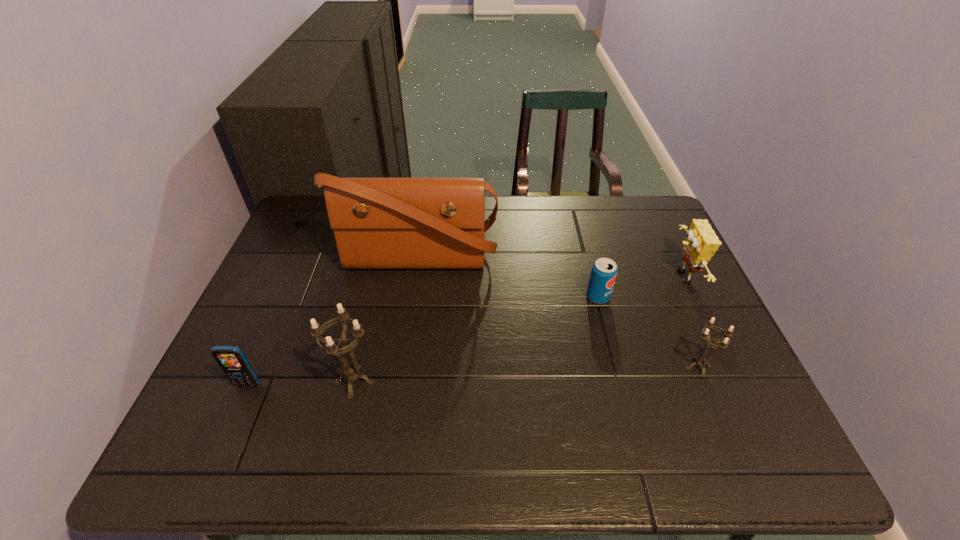
Identify the location of vacant area in the image that satisfies the following two spatial constraints: 1. on the front flap of the shorter candle holder; 2. on the left side of the tallest object. The image size is (960, 540). (402, 367).

The image size is (960, 540). Identify the location of free location that satisfies the following two spatial constraints: 1. on the face of the third tallest object; 2. on the front side of the taller candle holder. (731, 381).

You are a GUI agent. You are given a task and a screenshot of the screen. Output one action in this format:
    pyautogui.click(x=<x>, y=<y>)
    Task: Click on the vacant area in the image that satisfies the following two spatial constraints: 1. on the face of the sponge; 2. on the screen of the leftmost object
    The image size is (960, 540).
    Given the screenshot: What is the action you would take?
    pyautogui.click(x=732, y=385)